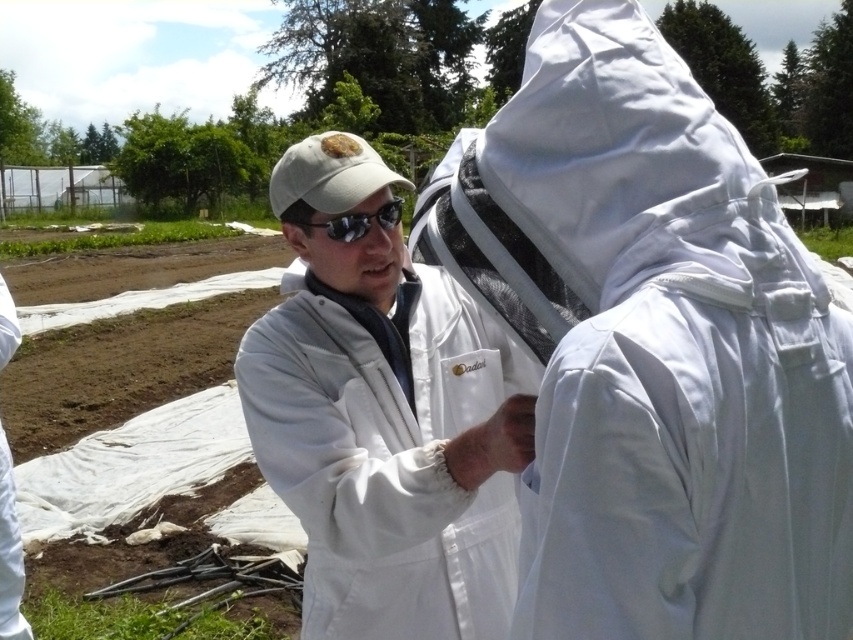
Between point (764, 330) and point (479, 349), which one is positioned in front?

Point (764, 330) is more forward.

Is point (630, 392) farther from viewer compared to point (486, 381)?

No, (630, 392) is closer to viewer.

Where is `white fabric beekeeping suit at center`? The image size is (853, 640). white fabric beekeeping suit at center is located at coordinates (653, 346).